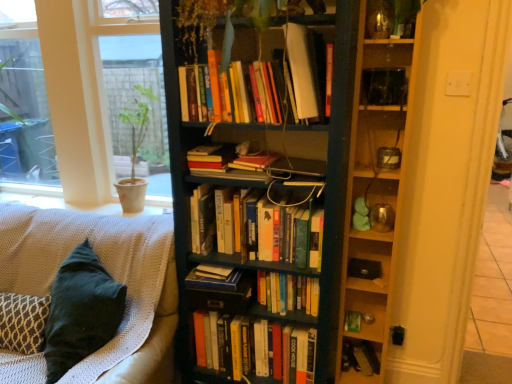
Question: Does velvet teal pillow at lower left have a smaller size compared to hardcover books at center, arranged as the fourth book when ordered from the bottom?

Choices:
 (A) yes
 (B) no

Answer: (B)

Question: Can you confirm if velvet teal pillow at lower left is thinner than hardcover books at center, arranged as the fourth book when ordered from the bottom?

Choices:
 (A) no
 (B) yes

Answer: (A)

Question: Is velvet teal pillow at lower left to the left of hardcover books at center, the fifth book in the top-to-bottom sequence, from the viewer's perspective?

Choices:
 (A) no
 (B) yes

Answer: (B)

Question: Considering the relative positions of velvet teal pillow at lower left and hardcover books at center, arranged as the fourth book when ordered from the bottom, in the image provided, is velvet teal pillow at lower left to the right of hardcover books at center, arranged as the fourth book when ordered from the bottom, from the viewer's perspective?

Choices:
 (A) yes
 (B) no

Answer: (B)

Question: Is velvet teal pillow at lower left shorter than hardcover books at center, the fifth book in the top-to-bottom sequence?

Choices:
 (A) no
 (B) yes

Answer: (A)

Question: Are velvet teal pillow at lower left and hardcover books at center, arranged as the fourth book when ordered from the bottom, far apart?

Choices:
 (A) yes
 (B) no

Answer: (B)

Question: Does hardcover book at center, the sixth book in the bottom-to-top sequence, have a greater height compared to hardcover books at center, the fifth book in the top-to-bottom sequence?

Choices:
 (A) yes
 (B) no

Answer: (B)

Question: Is hardcover book at center, the sixth book in the bottom-to-top sequence, closer to the viewer compared to hardcover books at center, the fifth book in the top-to-bottom sequence?

Choices:
 (A) yes
 (B) no

Answer: (A)

Question: Does hardcover book at center, acting as the third book starting from the top, have a lesser width compared to hardcover books at center, the fifth book in the top-to-bottom sequence?

Choices:
 (A) yes
 (B) no

Answer: (B)

Question: Is hardcover book at center, acting as the third book starting from the top, facing away from hardcover books at center, the fifth book in the top-to-bottom sequence?

Choices:
 (A) no
 (B) yes

Answer: (A)

Question: From a real-world perspective, is hardcover book at center, the sixth book in the bottom-to-top sequence, located higher than hardcover books at center, the fifth book in the top-to-bottom sequence?

Choices:
 (A) no
 (B) yes

Answer: (B)

Question: Is hardcover book at center, acting as the third book starting from the top, with hardcover books at center, arranged as the fourth book when ordered from the bottom?

Choices:
 (A) yes
 (B) no

Answer: (B)

Question: Is matte beige pot at left turned away from green matte paperback book at lower right?

Choices:
 (A) no
 (B) yes

Answer: (A)